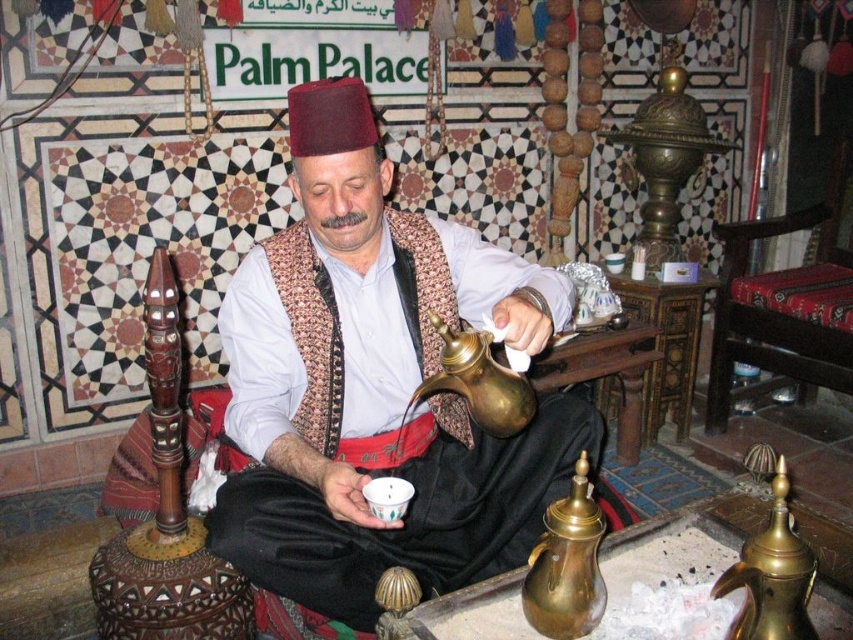
Question: Is brass teapot at lower center positioned behind brass teapot at center?

Choices:
 (A) yes
 (B) no

Answer: (B)

Question: Which point is closer to the camera?

Choices:
 (A) brass teapot at center
 (B) matte gold teapot at center
 (C) brass teapot at lower right
 (D) brass teapot at lower center

Answer: (C)

Question: Among these points, which one is farthest from the camera?

Choices:
 (A) (566, 504)
 (B) (415, 273)
 (C) (805, 552)

Answer: (B)

Question: Can you confirm if brass teapot at lower center is bigger than brass teapot at center?

Choices:
 (A) yes
 (B) no

Answer: (B)

Question: Estimate the real-world distances between objects in this image. Which object is farther from the brass teapot at lower center?

Choices:
 (A) brass teapot at lower right
 (B) matte gold teapot at center
 (C) brass teapot at center

Answer: (B)

Question: Can you confirm if brass teapot at lower center is wider than brass teapot at center?

Choices:
 (A) yes
 (B) no

Answer: (B)